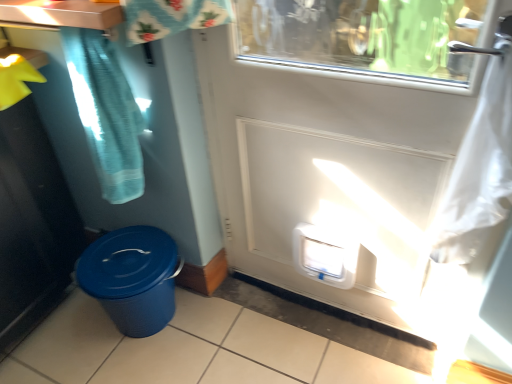
Question: From a real-world perspective, is blue textured plastic bin at lower left beneath white plastic water cooler at lower center?

Choices:
 (A) no
 (B) yes

Answer: (B)

Question: From the image's perspective, is blue textured plastic bin at lower left on top of white plastic water cooler at lower center?

Choices:
 (A) no
 (B) yes

Answer: (A)

Question: Are blue textured plastic bin at lower left and white plastic water cooler at lower center located far from each other?

Choices:
 (A) yes
 (B) no

Answer: (B)

Question: Is blue textured plastic bin at lower left positioned with its back to white plastic water cooler at lower center?

Choices:
 (A) yes
 (B) no

Answer: (B)

Question: Is blue textured plastic bin at lower left not inside white plastic water cooler at lower center?

Choices:
 (A) no
 (B) yes

Answer: (B)

Question: From a real-world perspective, is white plastic door at center positioned above or below blue textured plastic bin at lower left?

Choices:
 (A) above
 (B) below

Answer: (A)

Question: Considering the positions of white plastic door at center and blue textured plastic bin at lower left in the image, is white plastic door at center taller or shorter than blue textured plastic bin at lower left?

Choices:
 (A) tall
 (B) short

Answer: (A)

Question: Considering their positions, is white plastic door at center located in front of or behind blue textured plastic bin at lower left?

Choices:
 (A) front
 (B) behind

Answer: (A)

Question: Is white plastic door at center inside or outside of blue textured plastic bin at lower left?

Choices:
 (A) inside
 (B) outside

Answer: (B)

Question: From the image's perspective, is white plastic door at center above or below white plastic water cooler at lower center?

Choices:
 (A) below
 (B) above

Answer: (B)

Question: From a real-world perspective, is white plastic door at center physically located above or below white plastic water cooler at lower center?

Choices:
 (A) below
 (B) above

Answer: (B)

Question: Is white plastic door at center spatially inside white plastic water cooler at lower center, or outside of it?

Choices:
 (A) inside
 (B) outside

Answer: (B)

Question: Looking at their shapes, would you say white plastic door at center is wider or thinner than white plastic water cooler at lower center?

Choices:
 (A) thin
 (B) wide

Answer: (A)

Question: Considering the positions of white plastic door at center and teal fabric shower curtain at upper left in the image, is white plastic door at center wider or thinner than teal fabric shower curtain at upper left?

Choices:
 (A) wide
 (B) thin

Answer: (B)

Question: Based on their positions, is white plastic door at center located to the left or right of teal fabric shower curtain at upper left?

Choices:
 (A) right
 (B) left

Answer: (A)